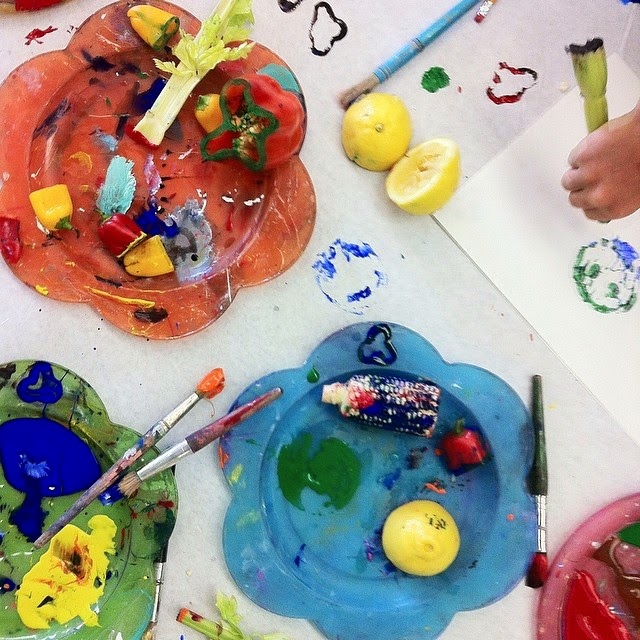
At what (x,y) coordinates should I click in order to perform the action: click on green plate. Please return your answer as a coordinate pair (x, y). This screenshot has height=640, width=640. Looking at the image, I should click on (125, 601).